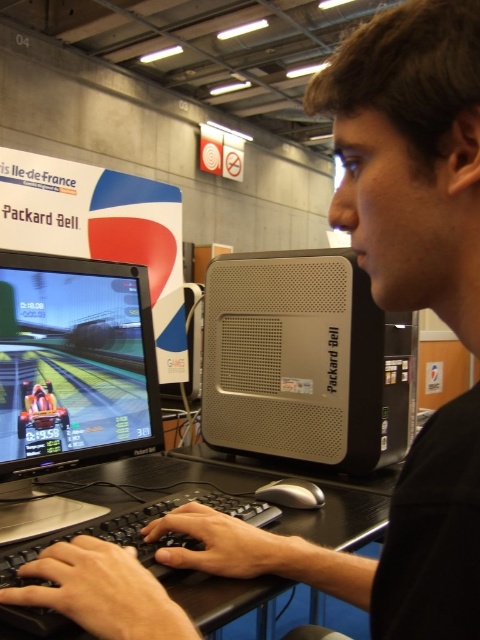
Describe the element at coordinates (304, 362) in the screenshot. I see `silver metallic computer at center` at that location.

Which is more to the right, silver metallic computer at center or black glossy monitor at left?

silver metallic computer at center is more to the right.

Locate an element on the screen. This screenshot has height=640, width=480. silver metallic computer at center is located at coordinates (304, 362).

Based on the photo, is silver metallic computer at center below black plastic keyboard at lower center?

Actually, silver metallic computer at center is above black plastic keyboard at lower center.

Can you confirm if silver metallic computer at center is taller than black plastic keyboard at lower center?

Yes.

Is point (317, 433) farther from viewer compared to point (251, 588)?

Yes.

What are the coordinates of `silver metallic computer at center` in the screenshot? It's located at (304, 362).

The height and width of the screenshot is (640, 480). What do you see at coordinates (70, 381) in the screenshot?
I see `black glossy monitor at left` at bounding box center [70, 381].

Between point (15, 433) and point (271, 472), which one is positioned in front?

Point (15, 433) is more forward.

Which is in front, point (142, 442) or point (361, 504)?

Point (361, 504) is in front.

Where is `black glossy monitor at left`? black glossy monitor at left is located at coordinates (70, 381).